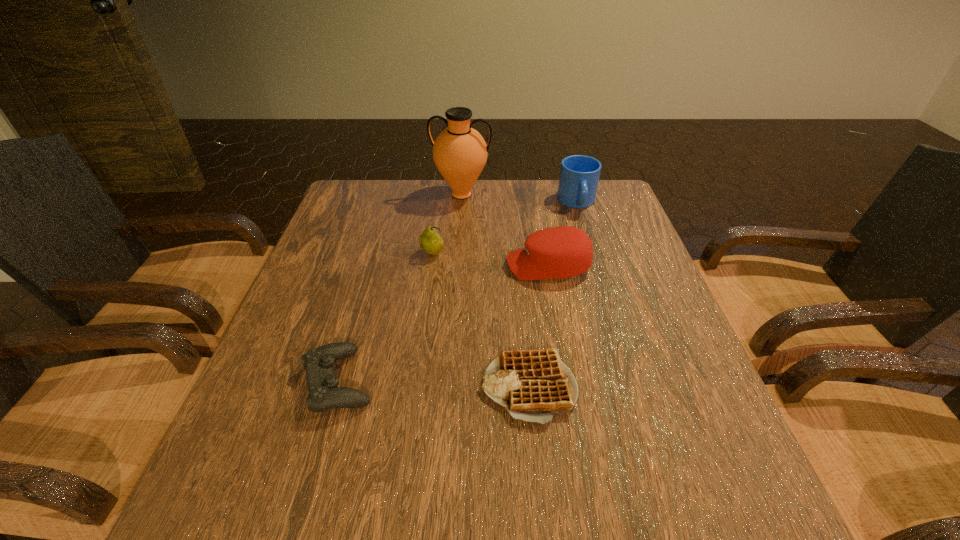
This screenshot has height=540, width=960. Identify the location of object that is at the far right corner. (579, 175).

Find the location of a particular element. vacant space at the far edge of the desktop is located at coordinates (555, 208).

In the image, there is a desktop. Identify the location of blank space at the left edge. This screenshot has width=960, height=540. (348, 267).

In order to click on free region at the right edge in this screenshot , I will do `click(610, 261)`.

The height and width of the screenshot is (540, 960). Identify the location of free space at the far left corner of the desktop. (341, 207).

I want to click on blank area at the near left corner, so click(x=242, y=527).

Where is `vacant area at the far right corner`? The height and width of the screenshot is (540, 960). vacant area at the far right corner is located at coordinates (623, 210).

Identify the location of empty space between the second tallest object and the control. (458, 292).

Image resolution: width=960 pixels, height=540 pixels. What are the coordinates of `vacant point located between the pear and the fifth tallest object` in the screenshot? It's located at [x=386, y=318].

Locate an element on the screen. The image size is (960, 540). unoccupied position between the fifth shortest object and the shortest object is located at coordinates (553, 294).